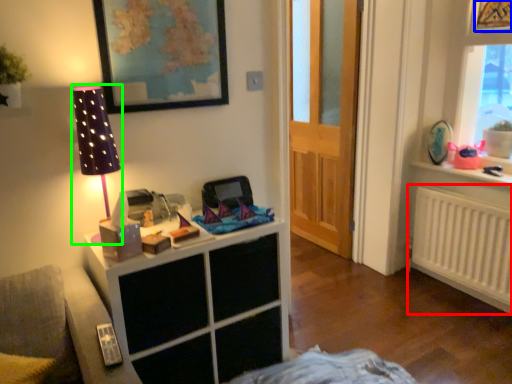
Question: Which object is positioned farthest from radiator (highlighted by a red box)? Select from picture frame (highlighted by a blue box) and table lamp (highlighted by a green box).

Choices:
 (A) picture frame
 (B) table lamp

Answer: (B)